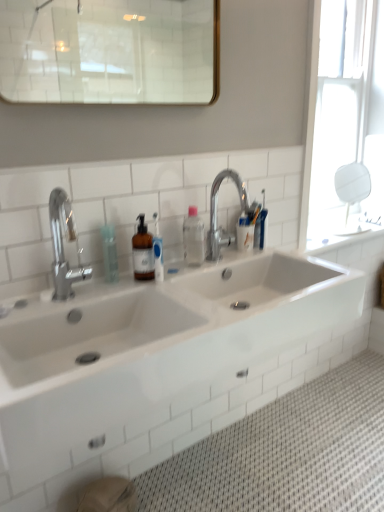
What are the coordinates of `free space on the front side of transparent plastic bottle at center` in the screenshot? It's located at (108, 293).